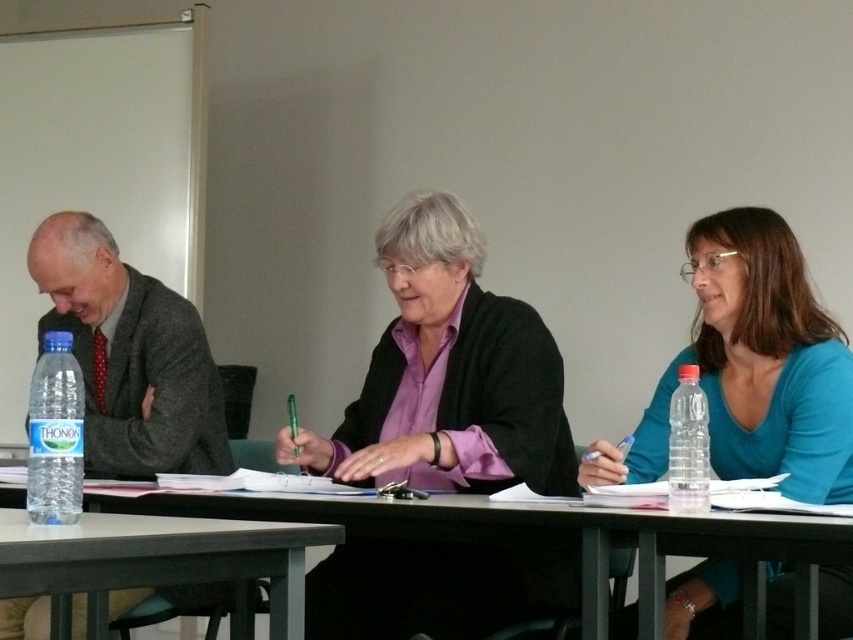
You are standing 1.5 meters away from the table. Is the point at coordinates point (469, 589) on the table closer to you or farther than your current position?

The point at coordinates point (469, 589) on the table is farther than your current position since it is 2.00 meters away from the viewer, which is beyond your 1.5 meters distance from the table.

You are organizing a small event and need to place a 12 inch wide decorative plate between the gray woolen suit at left and the gray matte table at center. Is there enough space for it?

The gray woolen suit at left is 32.92 inches away from the gray matte table at center, so there is enough space to place a 12 inch wide decorative plate between them since 32.92 inches is greater than 12 inches.